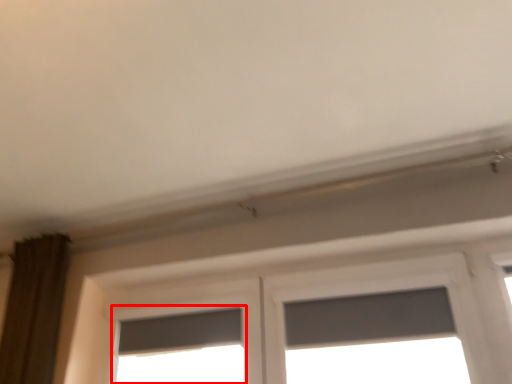
Question: From the image's perspective, what is the correct spatial positioning of window (annotated by the red box) in reference to window screen?

Choices:
 (A) above
 (B) below

Answer: (B)